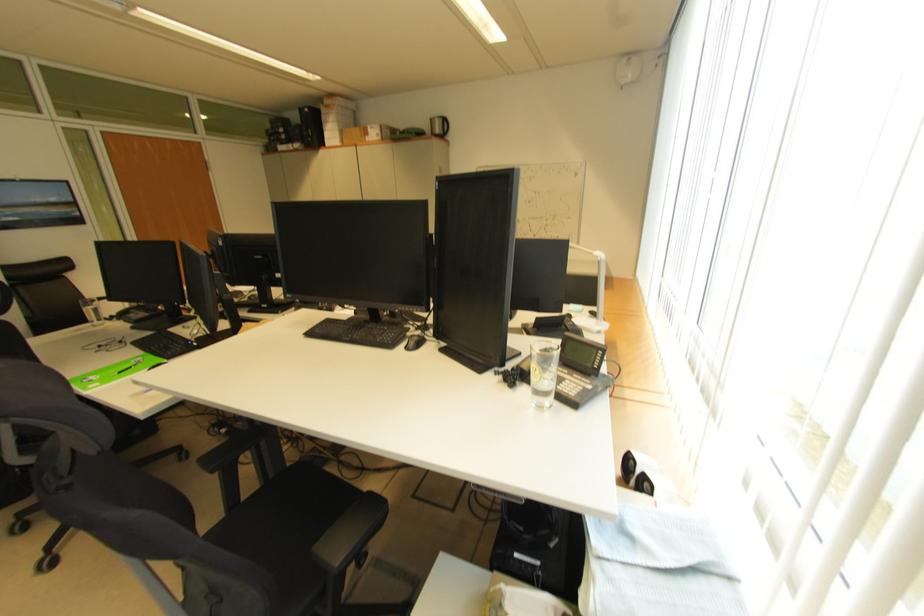
Find where to adjust the white lamp head. Please return your answer as a coordinate pair (x, y).

(589, 254)